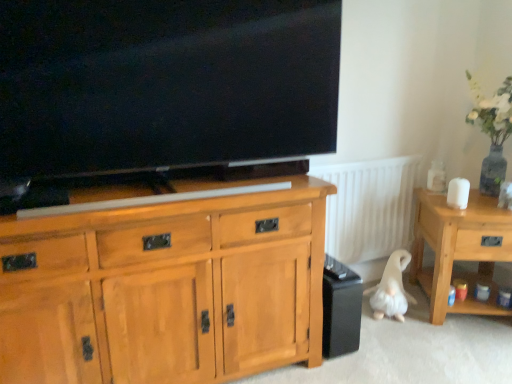
Question: Is light brown wood cabinet at center looking in the opposite direction of white plush dog at lower right?

Choices:
 (A) no
 (B) yes

Answer: (A)

Question: Is light brown wood cabinet at center thinner than white plush dog at lower right?

Choices:
 (A) no
 (B) yes

Answer: (A)

Question: From the image's perspective, is light brown wood cabinet at center below white plush dog at lower right?

Choices:
 (A) no
 (B) yes

Answer: (A)

Question: Considering the relative sizes of light brown wood cabinet at center and white plush dog at lower right in the image provided, is light brown wood cabinet at center taller than white plush dog at lower right?

Choices:
 (A) no
 (B) yes

Answer: (B)

Question: From the image's perspective, is light brown wood cabinet at center on top of white plush dog at lower right?

Choices:
 (A) no
 (B) yes

Answer: (B)

Question: Does light brown wood cabinet at center contain white plush dog at lower right?

Choices:
 (A) no
 (B) yes

Answer: (A)

Question: Is black matte speaker at lower right far from light brown wood cabinet at center?

Choices:
 (A) yes
 (B) no

Answer: (B)

Question: Is black matte speaker at lower right positioned behind light brown wood cabinet at center?

Choices:
 (A) yes
 (B) no

Answer: (A)

Question: Is black matte speaker at lower right oriented towards light brown wood cabinet at center?

Choices:
 (A) no
 (B) yes

Answer: (A)

Question: From a real-world perspective, is black matte speaker at lower right beneath light brown wood cabinet at center?

Choices:
 (A) yes
 (B) no

Answer: (A)

Question: Is black matte speaker at lower right directly adjacent to light brown wood cabinet at center?

Choices:
 (A) no
 (B) yes

Answer: (A)

Question: Considering the relative sizes of black matte speaker at lower right and light brown wood cabinet at center in the image provided, is black matte speaker at lower right shorter than light brown wood cabinet at center?

Choices:
 (A) no
 (B) yes

Answer: (B)

Question: Is matte black tv at upper center placed right next to white plush dog at lower right?

Choices:
 (A) yes
 (B) no

Answer: (B)